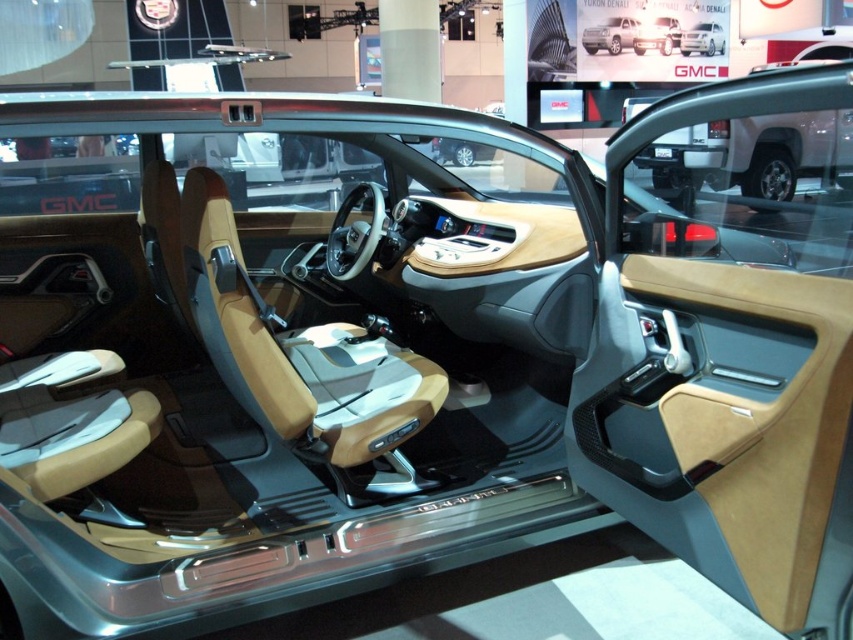
Is white matte truck at upper center wider than white glossy truck at upper center?

In fact, white matte truck at upper center might be narrower than white glossy truck at upper center.

Describe the element at coordinates (751, 156) in the screenshot. I see `white matte truck at upper center` at that location.

Describe the element at coordinates (751, 156) in the screenshot. I see `white matte truck at upper center` at that location.

The height and width of the screenshot is (640, 853). I want to click on white matte truck at upper center, so click(751, 156).